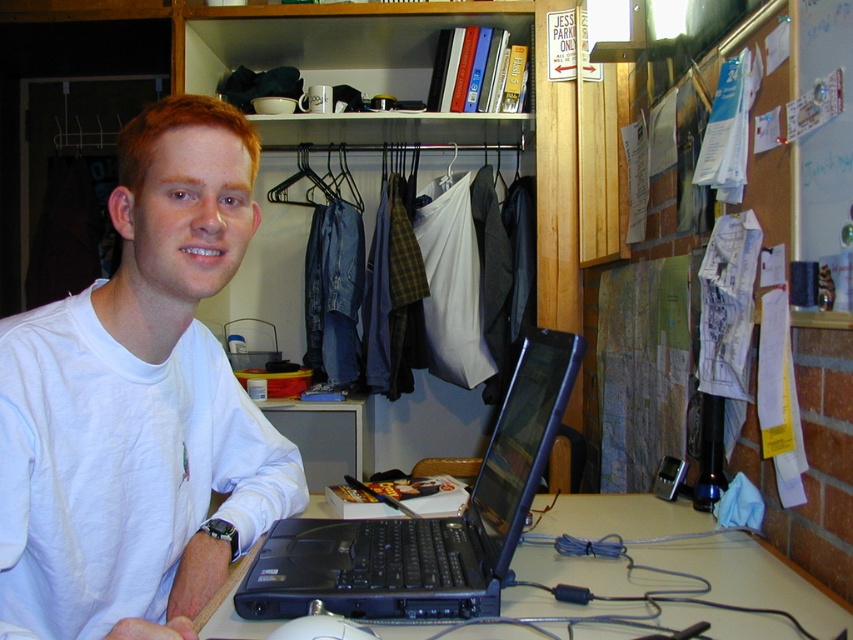
Question: Which object appears farthest from the camera in this image?

Choices:
 (A) white matte mouse at lower center
 (B) white cotton shirt at center

Answer: (B)

Question: Is white cotton shirt at center above black plastic laptop at lower center?

Choices:
 (A) no
 (B) yes

Answer: (B)

Question: Considering the real-world distances, which object is closest to the black plastic laptop at center?

Choices:
 (A) black plastic laptop at lower center
 (B) white cotton shirt at center
 (C) white matte mouse at lower center
 (D) wooden bookshelf at upper center

Answer: (A)

Question: Is wooden bookshelf at upper center further to camera compared to black plastic laptop at center?

Choices:
 (A) yes
 (B) no

Answer: (A)

Question: Among these objects, which one is nearest to the camera?

Choices:
 (A) white cotton shirt at center
 (B) black plastic laptop at lower center

Answer: (A)

Question: Can you confirm if white cotton shirt at center is bigger than black plastic laptop at lower center?

Choices:
 (A) no
 (B) yes

Answer: (B)